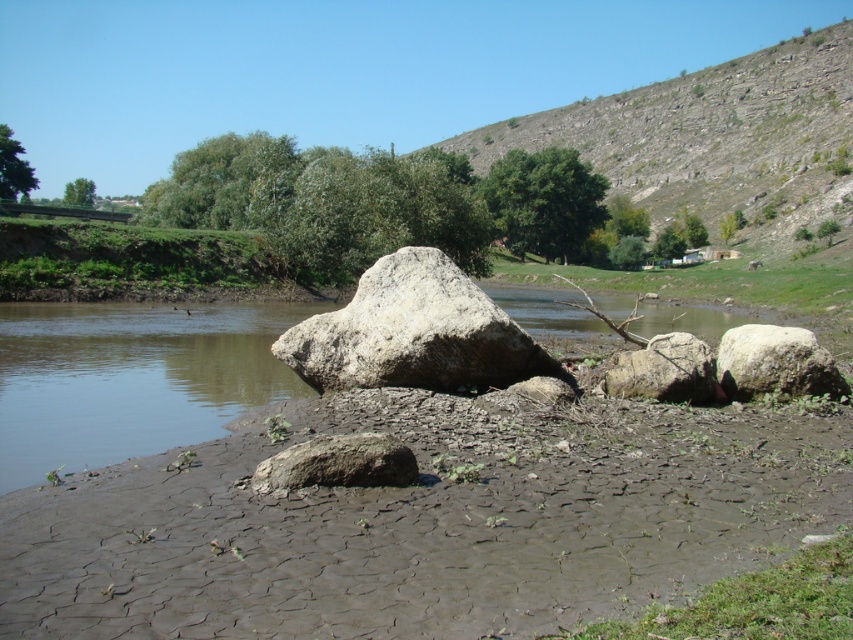
Can you confirm if gray rough rock at lower center is positioned to the left of smooth gray rock at center?

Yes, gray rough rock at lower center is to the left of smooth gray rock at center.

Which of these two, gray rough rock at lower center or smooth gray rock at center, stands taller?

With more height is smooth gray rock at center.

Between point (280, 456) and point (685, 356), which one is positioned in front?

Point (280, 456) is more forward.

Where is `gray rough rock at lower center`? This screenshot has height=640, width=853. gray rough rock at lower center is located at coordinates (337, 464).

Which is behind, point (450, 570) or point (840, 376)?

Point (840, 376)

Is point (724, 472) less distant than point (790, 337)?

Yes.

Which is behind, point (816, 413) or point (780, 380)?

The point (780, 380) is more distant.

Find the location of `dull gray mud at lower center`. dull gray mud at lower center is located at coordinates (426, 522).

Who is taller, dull gray mud at lower center or gray rough rock at lower center?

gray rough rock at lower center is taller.

Does dull gray mud at lower center appear on the right side of gray rough rock at lower center?

Correct, you'll find dull gray mud at lower center to the right of gray rough rock at lower center.

Find the location of a particular element. The image size is (853, 640). dull gray mud at lower center is located at coordinates (426, 522).

Where is `dull gray mud at lower center`? dull gray mud at lower center is located at coordinates (426, 522).